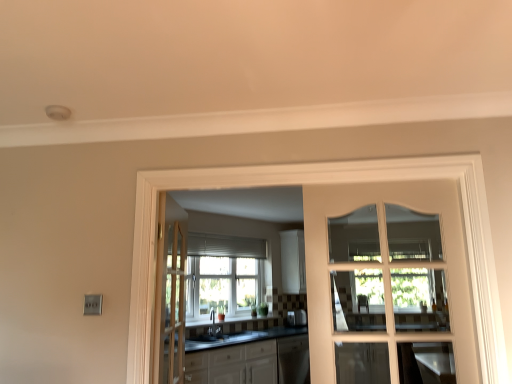
Question: Considering the positions of point (158, 352) and point (290, 322), is point (158, 352) closer or farther from the camera than point (290, 322)?

Choices:
 (A) farther
 (B) closer

Answer: (B)

Question: Relative to satin silver toaster at center, is light brown wooden door at center, the first door when ordered from back to front, in front or behind?

Choices:
 (A) behind
 (B) front

Answer: (B)

Question: Estimate the real-world distances between objects in this image. Which object is farther from the light brown wooden door at center, which ranks as the 2th door in front-to-back order?

Choices:
 (A) white glossy cabinets at center
 (B) matte black sink at center
 (C) clear glass window at center
 (D) satin silver toaster at center
 (E) white glass door at center

Answer: (D)

Question: Considering the real-world distances, which object is farthest from the satin silver toaster at center?

Choices:
 (A) matte black sink at center
 (B) clear glass window at center
 (C) light brown wooden door at center, which is the 1th door from left to right
 (D) white glass door at center
 (E) white glossy cabinets at center

Answer: (D)